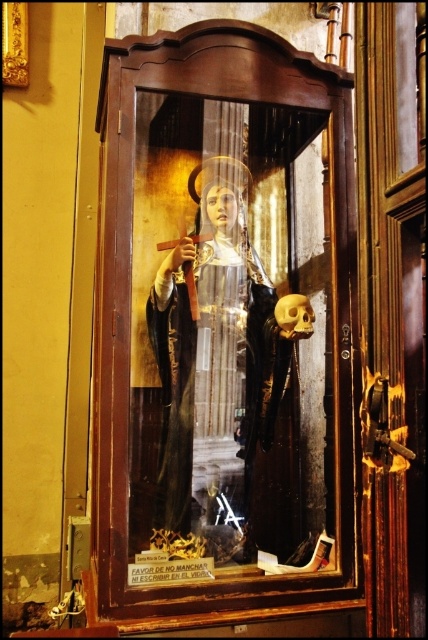
How much distance is there between wooden cabinet at center and matte black robe at center?

wooden cabinet at center and matte black robe at center are 11.50 centimeters apart.

Between point (335, 340) and point (231, 269), which one is positioned in front?

Point (335, 340)

Image resolution: width=428 pixels, height=640 pixels. What are the coordinates of `wooden cabinet at center` in the screenshot? It's located at (219, 330).